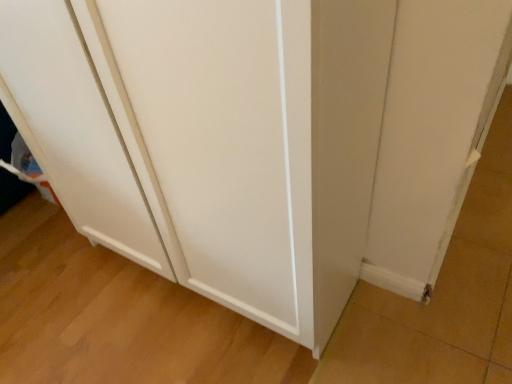
Measure the distance between white matte door at lower right and camera.

white matte door at lower right and camera are 24.08 inches apart from each other.

The image size is (512, 384). Describe the element at coordinates (432, 133) in the screenshot. I see `white matte door at lower right` at that location.

Identify the location of white matte door at lower right. The width and height of the screenshot is (512, 384). (432, 133).

Identify the location of white matte door at lower right. (432, 133).